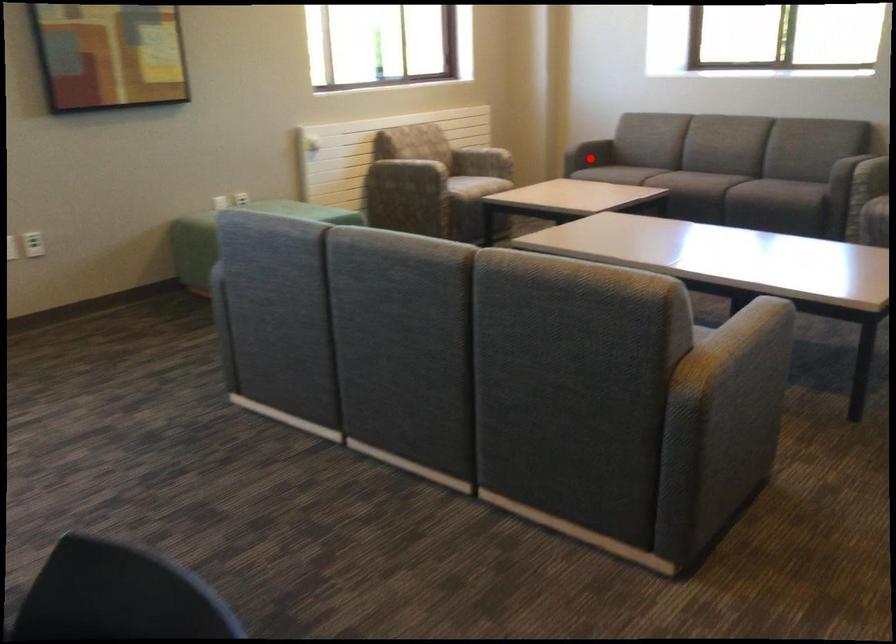
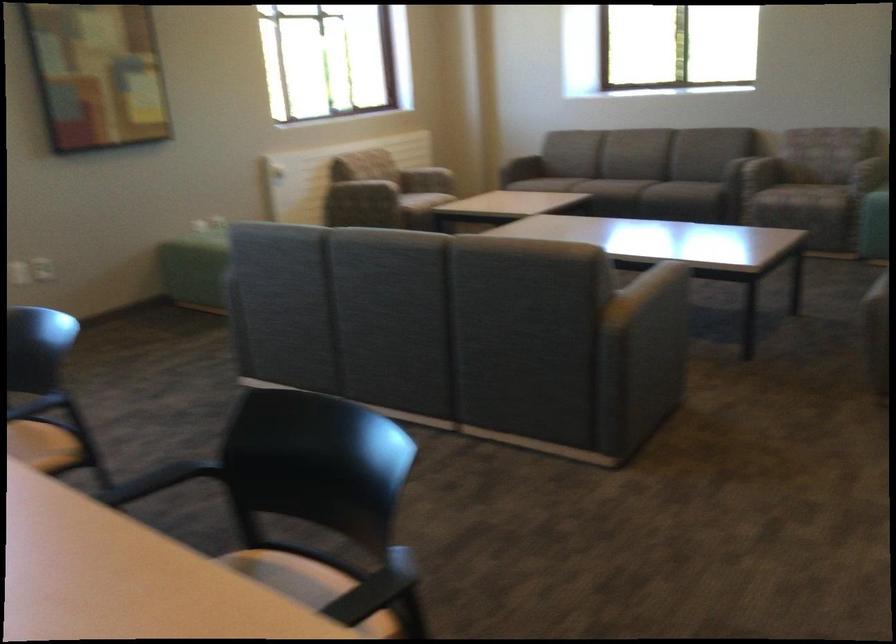
The point at the highlighted location is marked in the first image. Where is the corresponding point in the second image?

(522, 167)